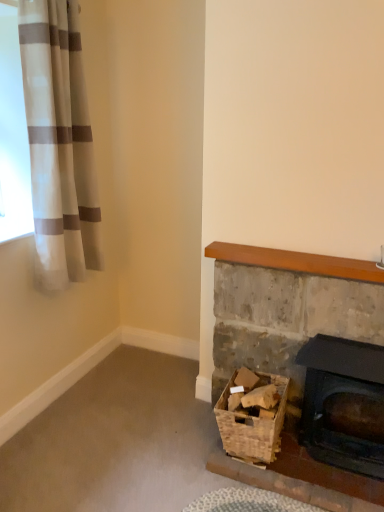
Question: Does white striped fabric at upper left turn towards matte black fireplace at lower right, the first fireplace in the right-to-left sequence?

Choices:
 (A) no
 (B) yes

Answer: (B)

Question: Can you confirm if white striped fabric at upper left is smaller than matte black fireplace at lower right, the first fireplace in the right-to-left sequence?

Choices:
 (A) yes
 (B) no

Answer: (B)

Question: From a real-world perspective, is white striped fabric at upper left below matte black fireplace at lower right, the first fireplace in the right-to-left sequence?

Choices:
 (A) no
 (B) yes

Answer: (A)

Question: Is white striped fabric at upper left positioned behind matte black fireplace at lower right, which ranks as the 2th fireplace in left-to-right order?

Choices:
 (A) yes
 (B) no

Answer: (B)

Question: From the image's perspective, would you say white striped fabric at upper left is shown under matte black fireplace at lower right, which ranks as the 2th fireplace in left-to-right order?

Choices:
 (A) no
 (B) yes

Answer: (A)

Question: Can we say white striped fabric at upper left lies outside matte black fireplace at lower right, which ranks as the 2th fireplace in left-to-right order?

Choices:
 (A) yes
 (B) no

Answer: (A)

Question: Is matte black fireplace at lower right, the first fireplace in the right-to-left sequence, to the right of rustic stone fireplace at lower right, which is the 1th fireplace from left to right, from the viewer's perspective?

Choices:
 (A) no
 (B) yes

Answer: (B)

Question: From the image's perspective, does matte black fireplace at lower right, which ranks as the 2th fireplace in left-to-right order, appear higher than rustic stone fireplace at lower right, which is the 1th fireplace from left to right?

Choices:
 (A) yes
 (B) no

Answer: (B)

Question: Does matte black fireplace at lower right, which ranks as the 2th fireplace in left-to-right order, have a greater height compared to rustic stone fireplace at lower right, which is the 1th fireplace from left to right?

Choices:
 (A) no
 (B) yes

Answer: (A)

Question: Can we say matte black fireplace at lower right, the first fireplace in the right-to-left sequence, lies outside rustic stone fireplace at lower right, marked as the second fireplace in a right-to-left arrangement?

Choices:
 (A) no
 (B) yes

Answer: (B)

Question: Is matte black fireplace at lower right, which ranks as the 2th fireplace in left-to-right order, shorter than rustic stone fireplace at lower right, marked as the second fireplace in a right-to-left arrangement?

Choices:
 (A) yes
 (B) no

Answer: (A)

Question: From a real-world perspective, does matte black fireplace at lower right, the first fireplace in the right-to-left sequence, sit lower than rustic stone fireplace at lower right, marked as the second fireplace in a right-to-left arrangement?

Choices:
 (A) yes
 (B) no

Answer: (A)

Question: Is white striped fabric at upper left not close to woven brown basket at lower right?

Choices:
 (A) yes
 (B) no

Answer: (A)